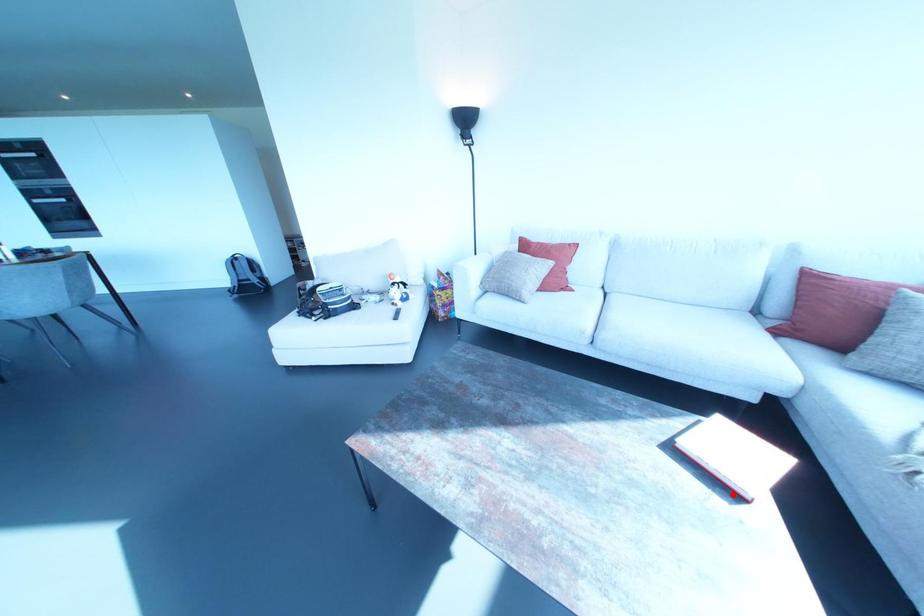
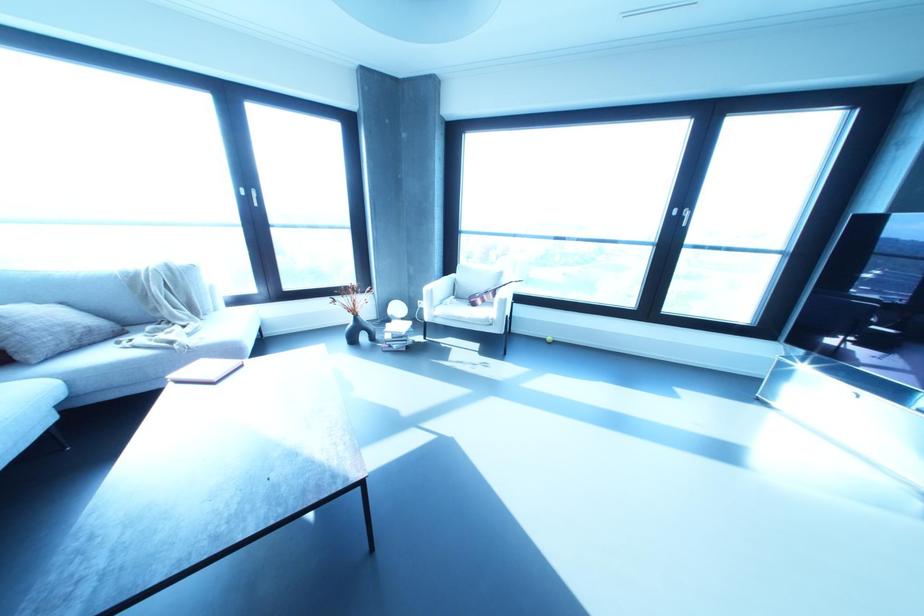
Where in the second image is the point corresponding to the highlighted location from the first image?

(241, 365)